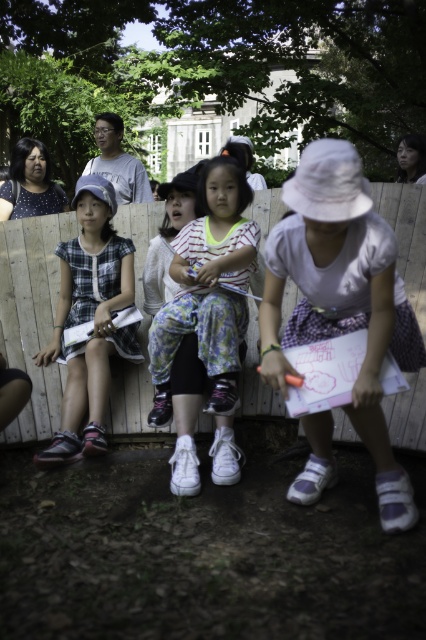
Question: Which point is farther from the camera taking this photo?

Choices:
 (A) (91, 337)
 (B) (166, 330)
 (C) (420, 234)

Answer: (C)

Question: Among these points, which one is farthest from the camera?

Choices:
 (A) (236, 273)
 (B) (60, 451)

Answer: (B)

Question: Among these points, which one is farthest from the camera?

Choices:
 (A) (109, 381)
 (B) (310, 195)
 (C) (169, 376)

Answer: (A)

Question: Is wooden fence at center to the right of plaid fabric dress at center from the viewer's perspective?

Choices:
 (A) no
 (B) yes

Answer: (A)

Question: Can you confirm if wooden fence at center is bigger than white matte sneakers at center?

Choices:
 (A) yes
 (B) no

Answer: (B)

Question: Does white cotton bucket hat at center appear on the left side of plaid fabric dress at center?

Choices:
 (A) yes
 (B) no

Answer: (B)